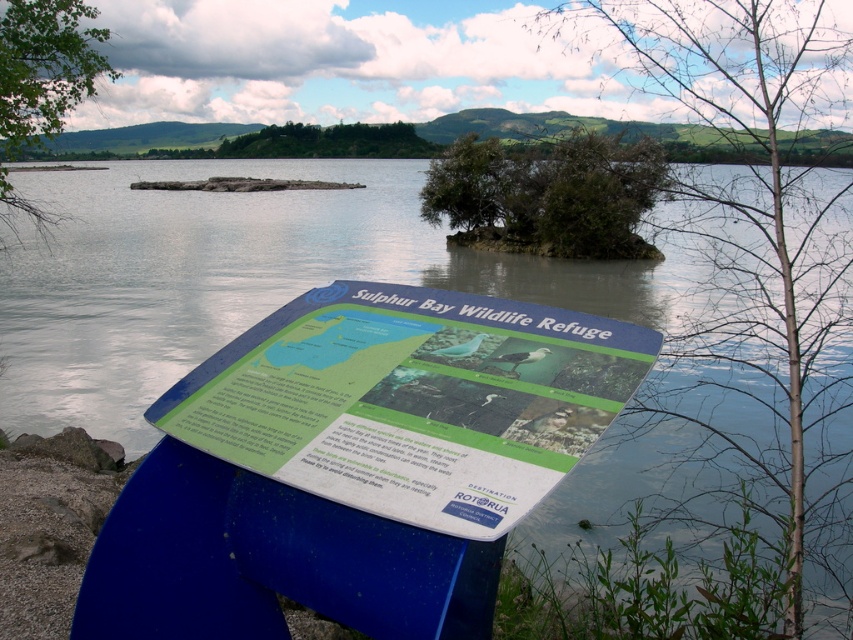
Question: Can you confirm if green leafy bush at center is bigger than green leafy tree at upper left?

Choices:
 (A) yes
 (B) no

Answer: (A)

Question: Estimate the real-world distances between objects in this image. Which object is farther from the green leafy tree at upper left?

Choices:
 (A) green leafy tree at center
 (B) green leafy bush at center

Answer: (B)

Question: Based on their relative distances, which object is farther from the green leafy bush at center?

Choices:
 (A) green leafy tree at upper left
 (B) green leafy tree at center

Answer: (A)

Question: Which of the following is the farthest from the observer?

Choices:
 (A) (633, 198)
 (B) (791, 19)

Answer: (A)

Question: Is green leafy tree at center closer to camera compared to green leafy tree at upper left?

Choices:
 (A) yes
 (B) no

Answer: (A)

Question: Considering the relative positions of green leafy tree at center and green leafy tree at upper left in the image provided, where is green leafy tree at center located with respect to green leafy tree at upper left?

Choices:
 (A) above
 (B) below

Answer: (B)